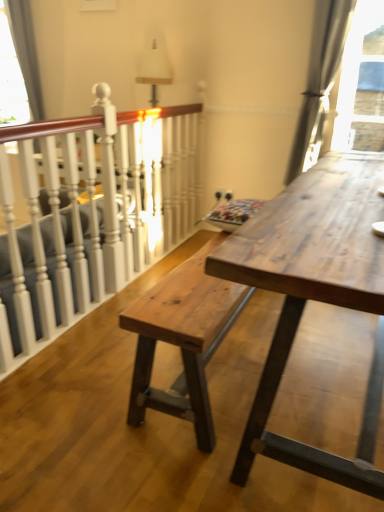
Where is `natural wood table at center`? The width and height of the screenshot is (384, 512). natural wood table at center is located at coordinates (314, 297).

Describe the element at coordinates (92, 214) in the screenshot. The width and height of the screenshot is (384, 512). I see `white painted wood at left` at that location.

Where is `satin gray curtain at upper right`? satin gray curtain at upper right is located at coordinates (319, 81).

The width and height of the screenshot is (384, 512). What are the coordinates of `natural wood bench at center` in the screenshot? It's located at (183, 340).

Can you confirm if satin gray curtain at upper right is wider than natural wood table at center?

In fact, satin gray curtain at upper right might be narrower than natural wood table at center.

Is point (319, 4) positioned behind point (283, 331)?

Yes, it is.

Who is smaller, satin gray curtain at upper right or natural wood table at center?

satin gray curtain at upper right.

Between natural wood bench at center and white painted wood at left, which one has larger size?

Bigger between the two is white painted wood at left.

Is natural wood bench at center not near white painted wood at left?

No, natural wood bench at center is in close proximity to white painted wood at left.

Is natural wood bench at center aimed at white painted wood at left?

No, natural wood bench at center is not oriented towards white painted wood at left.

Which of these two, natural wood bench at center or white painted wood at left, is wider?

natural wood bench at center is wider.

Would you say satin gray curtain at upper right is to the left or to the right of natural wood bench at center in the picture?

Clearly, satin gray curtain at upper right is on the right of natural wood bench at center in the image.

Is point (351, 5) positioned in front of point (204, 399)?

No, (351, 5) is behind (204, 399).

Is satin gray curtain at upper right facing away from natural wood bench at center?

No, satin gray curtain at upper right is not facing away from natural wood bench at center.

From the image's perspective, is satin gray curtain at upper right beneath natural wood bench at center?

Incorrect, from the image's perspective, satin gray curtain at upper right is higher than natural wood bench at center.

Is white painted wood at left not within transparent glass window at upper left?

Yes, white painted wood at left is located beyond the bounds of transparent glass window at upper left.

How distant is white painted wood at left from transparent glass window at upper left?

white painted wood at left is 1.96 meters from transparent glass window at upper left.

Which object is positioned more to the left, white painted wood at left or transparent glass window at upper left?

transparent glass window at upper left.

Considering the sizes of objects white painted wood at left and transparent glass window at upper left in the image provided, who is shorter, white painted wood at left or transparent glass window at upper left?

transparent glass window at upper left.

From a real-world perspective, is natural wood table at center positioned under white painted wood at left based on gravity?

Yes, from a real-world perspective, natural wood table at center is under white painted wood at left.

Which object is closer to the camera, natural wood table at center or white painted wood at left?

Positioned in front is natural wood table at center.

Is natural wood bench at center positioned in front of transparent glass window at upper left?

Yes, it is.

Considering the sizes of objects natural wood bench at center and transparent glass window at upper left in the image provided, who is wider, natural wood bench at center or transparent glass window at upper left?

Wider between the two is natural wood bench at center.

Which is behind, point (243, 301) or point (36, 120)?

Point (36, 120)

Where is `bench below the transparent glass window at upper left (from the image's perspective)`? The image size is (384, 512). bench below the transparent glass window at upper left (from the image's perspective) is located at coordinates (183, 340).

Which is nearer, [175,207] or [193,290]?

Clearly, point [175,207] is more distant from the camera than point [193,290].

Could you tell me if white painted wood at left is facing natural wood bench at center?

Yes.

Would you say white painted wood at left is a long distance from natural wood bench at center?

white painted wood at left is actually quite close to natural wood bench at center.

Image resolution: width=384 pixels, height=512 pixels. In the image, there is a natural wood table at center. What are the coordinates of `curtain above it (from the image's perspective)` in the screenshot? It's located at (319, 81).

Identify the location of rail behind the natural wood bench at center. (92, 214).

Which object lies nearer to the anchor point natural wood table at center, satin gray curtain at upper right or transparent glass window at upper left?

Based on the image, satin gray curtain at upper right appears to be nearer to natural wood table at center.

Considering their positions, is transparent glass window at upper left positioned further to white painted wood at left than satin gray curtain at upper right?

transparent glass window at upper left is positioned further to the anchor white painted wood at left.

Estimate the real-world distances between objects in this image. Which object is further from transparent glass window at upper left, satin gray curtain at upper right or natural wood table at center?

Among the two, natural wood table at center is located further to transparent glass window at upper left.

Based on their spatial positions, is natural wood table at center or white painted wood at left further from natural wood bench at center?

Among the two, white painted wood at left is located further to natural wood bench at center.

From the image, which object appears to be farther from natural wood bench at center, natural wood table at center or transparent glass window at upper left?

The object further to natural wood bench at center is transparent glass window at upper left.

Looking at the image, which one is located further to natural wood table at center, transparent glass window at upper left or natural wood bench at center?

Among the two, transparent glass window at upper left is located further to natural wood table at center.

Based on the photo, based on their spatial positions, is natural wood table at center or satin gray curtain at upper right closer to white painted wood at left?

Among the two, natural wood table at center is located nearer to white painted wood at left.

Looking at the image, which one is located closer to natural wood table at center, satin gray curtain at upper right or white painted wood at left?

white painted wood at left is closer to natural wood table at center.

You are a GUI agent. You are given a task and a screenshot of the screen. Output one action in this format:
    pyautogui.click(x=<x>, y=<y>)
    Task: Click on the rail between natural wood table at center and satin gray curtain at upper right along the z-axis
    
    Given the screenshot: What is the action you would take?
    pyautogui.click(x=92, y=214)

Identify the location of rail between natural wood table at center and transparent glass window at upper left from front to back. (92, 214).

The width and height of the screenshot is (384, 512). I want to click on bench between white painted wood at left and natural wood table at center, so click(183, 340).

At what (x,y) coordinates should I click in order to perform the action: click on rail between natural wood bench at center and transparent glass window at upper left from front to back. Please return your answer as a coordinate pair (x, y). This screenshot has height=512, width=384. Looking at the image, I should click on [92, 214].